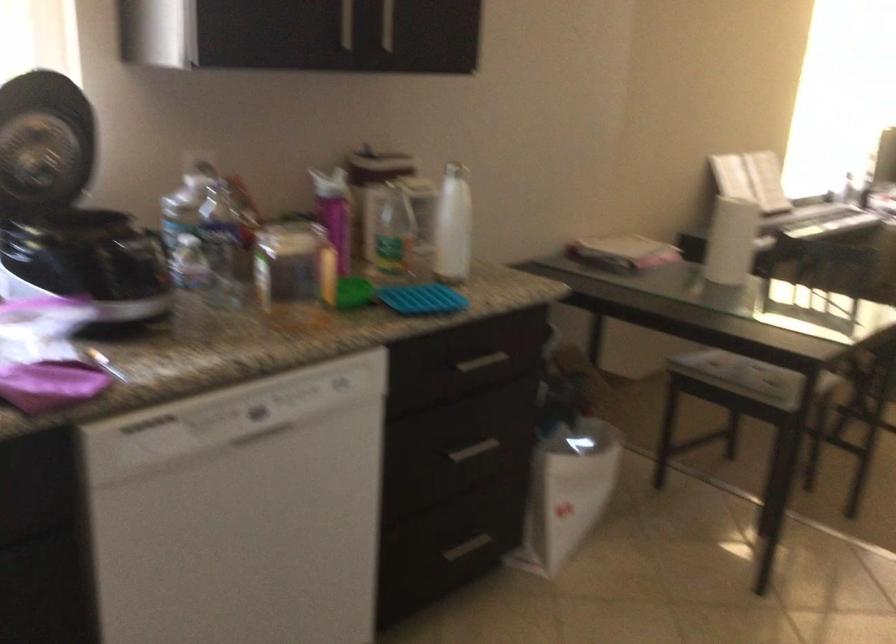
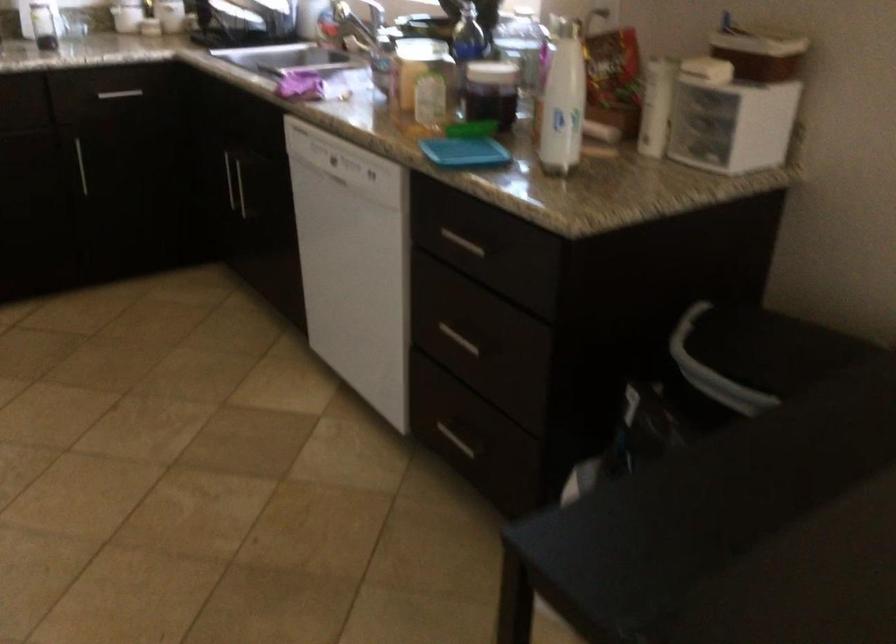
In the second image, find the point that corresponds to (426,424) in the first image.

(459, 339)